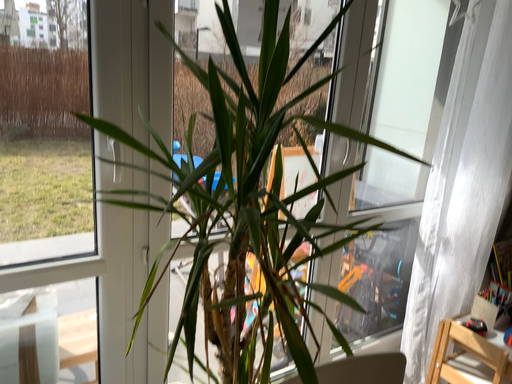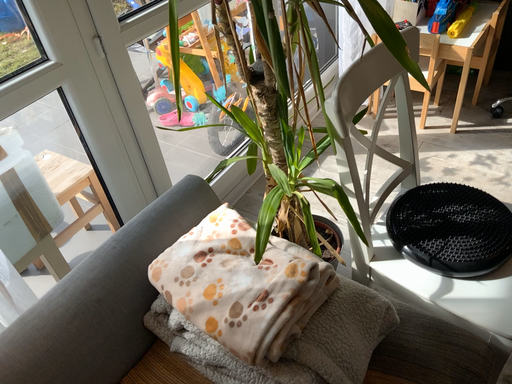
Question: How did the camera likely rotate when shooting the video?

Choices:
 (A) rotated right
 (B) rotated left

Answer: (A)